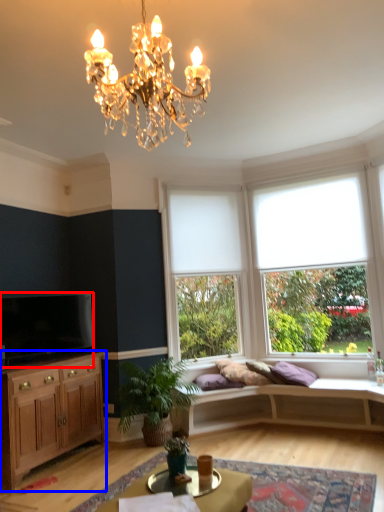
Question: Which object is further to the camera taking this photo, television (highlighted by a red box) or cabinetry (highlighted by a blue box)?

Choices:
 (A) television
 (B) cabinetry

Answer: (A)